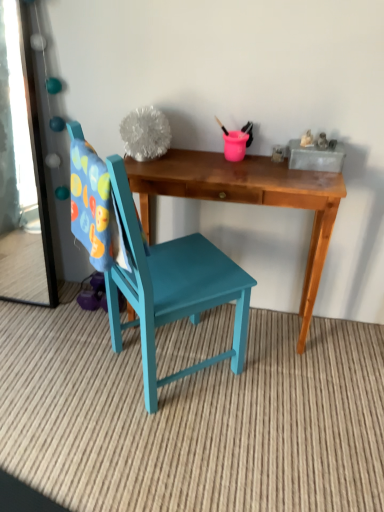
The image size is (384, 512). Find the location of `empty space that is in between wooden desk at center and teal painted wood chair at center`. empty space that is in between wooden desk at center and teal painted wood chair at center is located at coordinates (243, 360).